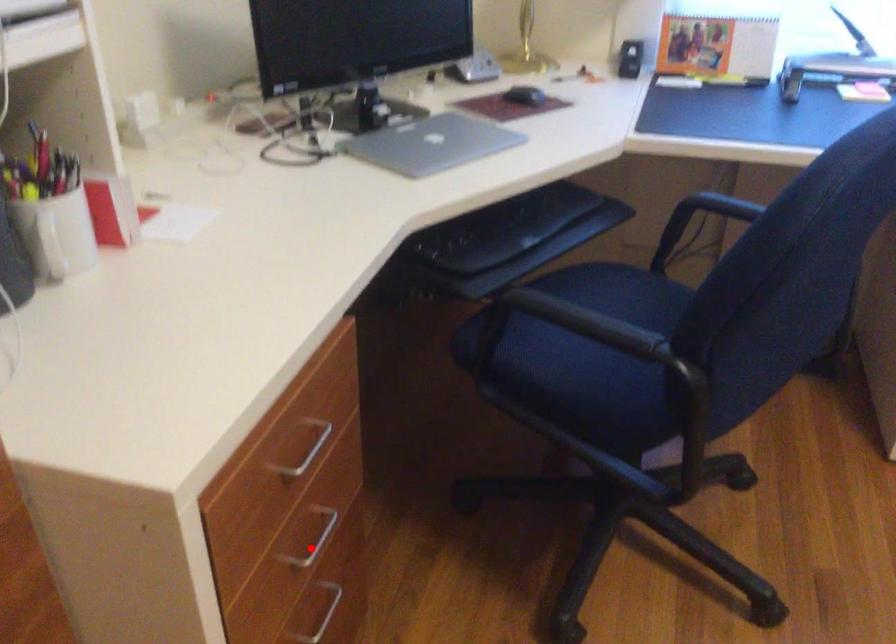
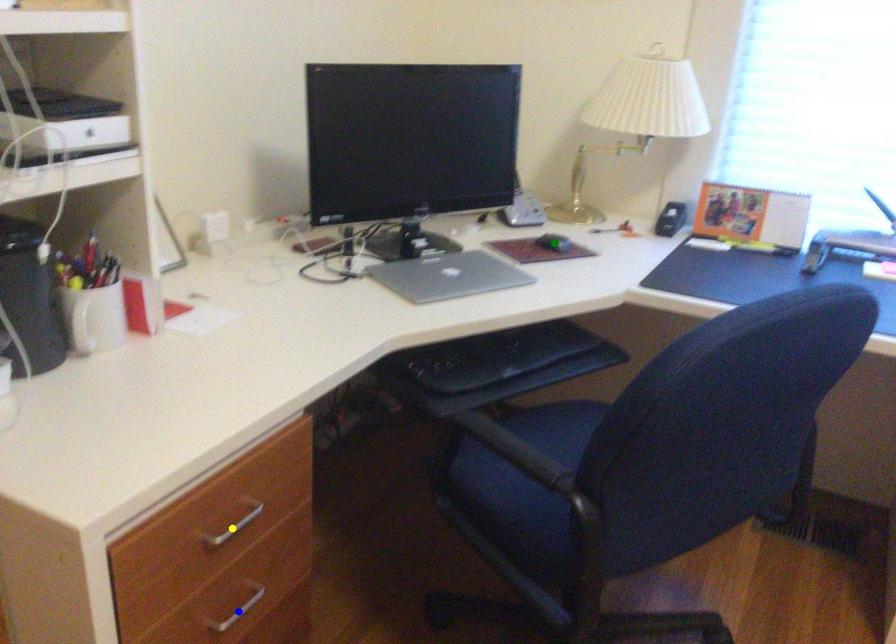
Question: I am providing you with two images of the same scene from different viewpoints. A red point is marked on the first image. You are given multiple points on the second image. Which point in image 2 represents the same 3d spot as the red point in image 1?

Choices:
 (A) yellow point
 (B) green point
 (C) blue point

Answer: (C)